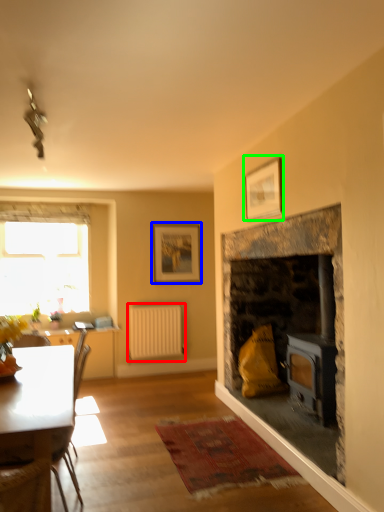
Question: Which object is the closest to the radiator (highlighted by a red box)? Choose among these: picture frame (highlighted by a blue box) or picture frame (highlighted by a green box).

Choices:
 (A) picture frame
 (B) picture frame

Answer: (A)